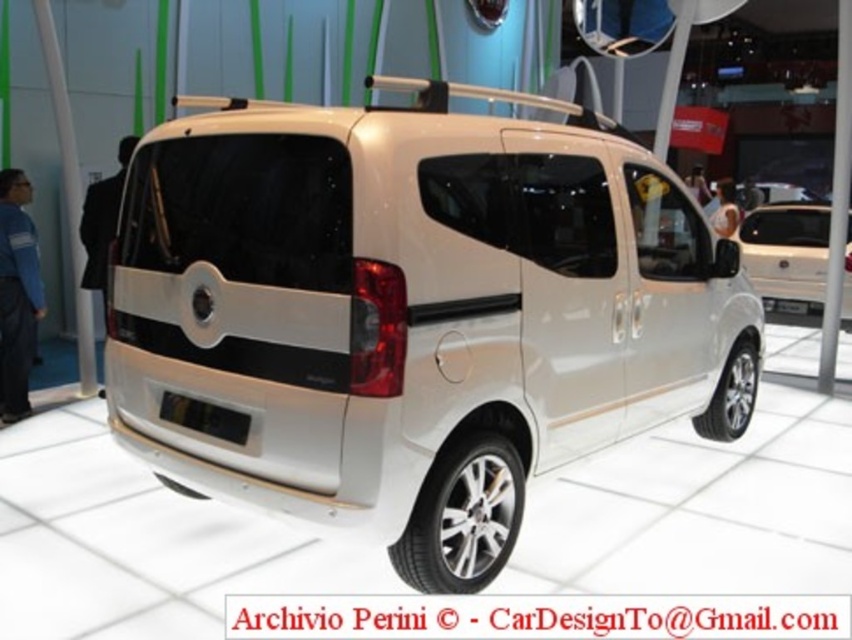
You are a photographer at an auto show and need to take a photo of the white metallic minivan at center and the white matte van at center. Which van should you focus on first if you want to capture the one closer to the front of the exhibition hall?

The white metallic minivan at center is positioned under the white matte van at center, meaning it is closer to the front. Therefore, focus on the white metallic minivan at center first to capture it before the van behind it.

You are standing in front of the white Fiat Doblo van at the exhibition. You notice two points marked on the van. The first point is at coordinate point (436, 220) and the second is at point (763, 292). If you were to reach out and touch both points, which one would feel closer to your hand?

Point (436, 220) is closer to the camera than point (763, 292), so touching point (436, 220) would feel closer to your hand.

You are standing at the entrance of the auto show. You want to locate the white metallic minivan at center. Where should you look?

You should look at point 0.484 on the horizontal axis and 0.484 on the vertical axis to locate the white metallic minivan at center.